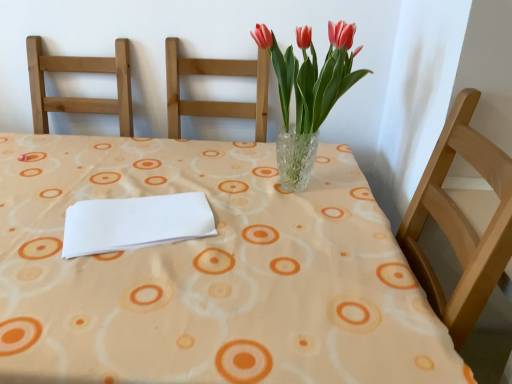
Question: Does white paper at center have a greater height compared to clear glass vase at center?

Choices:
 (A) yes
 (B) no

Answer: (B)

Question: Would you say clear glass vase at center is part of white paper at center's contents?

Choices:
 (A) no
 (B) yes

Answer: (A)

Question: Is clear glass vase at center at the back of white paper at center?

Choices:
 (A) yes
 (B) no

Answer: (A)

Question: From the image's perspective, is white paper at center located above clear glass vase at center?

Choices:
 (A) yes
 (B) no

Answer: (A)

Question: Does white paper at center appear on the left side of clear glass vase at center?

Choices:
 (A) no
 (B) yes

Answer: (B)

Question: Considering the positions of white paper at center and clear glass vase at center in the image, is white paper at center bigger or smaller than clear glass vase at center?

Choices:
 (A) big
 (B) small

Answer: (B)

Question: From the image's perspective, relative to clear glass vase at center, is white paper at center above or below?

Choices:
 (A) above
 (B) below

Answer: (A)

Question: Is white paper at center inside or outside of clear glass vase at center?

Choices:
 (A) outside
 (B) inside

Answer: (A)

Question: Relative to clear glass vase at center, is white paper at center in front or behind?

Choices:
 (A) behind
 (B) front

Answer: (A)

Question: Relative to translucent glass vase at center, is clear glass vase at center in front or behind?

Choices:
 (A) front
 (B) behind

Answer: (A)

Question: From the image's perspective, relative to translucent glass vase at center, is clear glass vase at center above or below?

Choices:
 (A) above
 (B) below

Answer: (B)

Question: Is clear glass vase at center taller or shorter than translucent glass vase at center?

Choices:
 (A) tall
 (B) short

Answer: (A)

Question: From a real-world perspective, is clear glass vase at center positioned above or below translucent glass vase at center?

Choices:
 (A) above
 (B) below

Answer: (B)

Question: Is point (308, 119) positioned closer to the camera than point (5, 299)?

Choices:
 (A) closer
 (B) farther

Answer: (B)

Question: In the image, is translucent glass vase at center positioned in front of or behind clear glass vase at center?

Choices:
 (A) behind
 (B) front

Answer: (A)